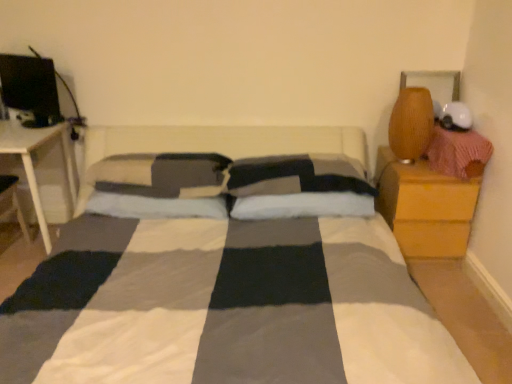
Question: Does matte black monitor at upper left have a larger size compared to white soft pillow at center, which ranks as the first pillow in right-to-left order?

Choices:
 (A) no
 (B) yes

Answer: (A)

Question: Considering the relative sizes of matte black monitor at upper left and white soft pillow at center, which ranks as the first pillow in right-to-left order, in the image provided, is matte black monitor at upper left shorter than white soft pillow at center, which ranks as the first pillow in right-to-left order,?

Choices:
 (A) no
 (B) yes

Answer: (A)

Question: From a real-world perspective, is matte black monitor at upper left on top of white soft pillow at center, which ranks as the first pillow in right-to-left order?

Choices:
 (A) no
 (B) yes

Answer: (B)

Question: Is matte black monitor at upper left to the right of white soft pillow at center, which is the 4th pillow in left-to-right order, from the viewer's perspective?

Choices:
 (A) no
 (B) yes

Answer: (A)

Question: Considering the relative sizes of matte black monitor at upper left and white soft pillow at center, which is the 4th pillow in left-to-right order, in the image provided, is matte black monitor at upper left smaller than white soft pillow at center, which is the 4th pillow in left-to-right order,?

Choices:
 (A) yes
 (B) no

Answer: (A)

Question: Is wooden nightstand at right inside or outside of checkered fabric pillow at center, acting as the 2th pillow starting from the right?

Choices:
 (A) inside
 (B) outside

Answer: (B)

Question: Does point click(x=423, y=203) appear closer or farther from the camera than point click(x=322, y=155)?

Choices:
 (A) closer
 (B) farther

Answer: (A)

Question: Is wooden nightstand at right to the left or to the right of checkered fabric pillow at center, acting as the 2th pillow starting from the right, in the image?

Choices:
 (A) right
 (B) left

Answer: (A)

Question: In terms of width, does wooden nightstand at right look wider or thinner when compared to checkered fabric pillow at center, acting as the 3th pillow starting from the left?

Choices:
 (A) wide
 (B) thin

Answer: (A)

Question: Is point 132,160 closer or farther from the camera than point 183,201?

Choices:
 (A) farther
 (B) closer

Answer: (A)

Question: From the image's perspective, is soft gray pillow at center, marked as the first pillow in a left-to-right arrangement, above or below soft gray pillow at center, which is the 3th pillow in right-to-left order?

Choices:
 (A) below
 (B) above

Answer: (B)

Question: In terms of size, does soft gray pillow at center, acting as the 4th pillow starting from the right, appear bigger or smaller than soft gray pillow at center, which is counted as the second pillow, starting from the left?

Choices:
 (A) small
 (B) big

Answer: (B)

Question: In terms of height, does soft gray pillow at center, acting as the 4th pillow starting from the right, look taller or shorter compared to soft gray pillow at center, which is the 3th pillow in right-to-left order?

Choices:
 (A) short
 (B) tall

Answer: (B)

Question: Is matte black monitor at upper left bigger or smaller than soft gray pillow at center, which is counted as the second pillow, starting from the left?

Choices:
 (A) small
 (B) big

Answer: (A)

Question: Is point (42, 81) positioned closer to the camera than point (220, 211)?

Choices:
 (A) closer
 (B) farther

Answer: (B)